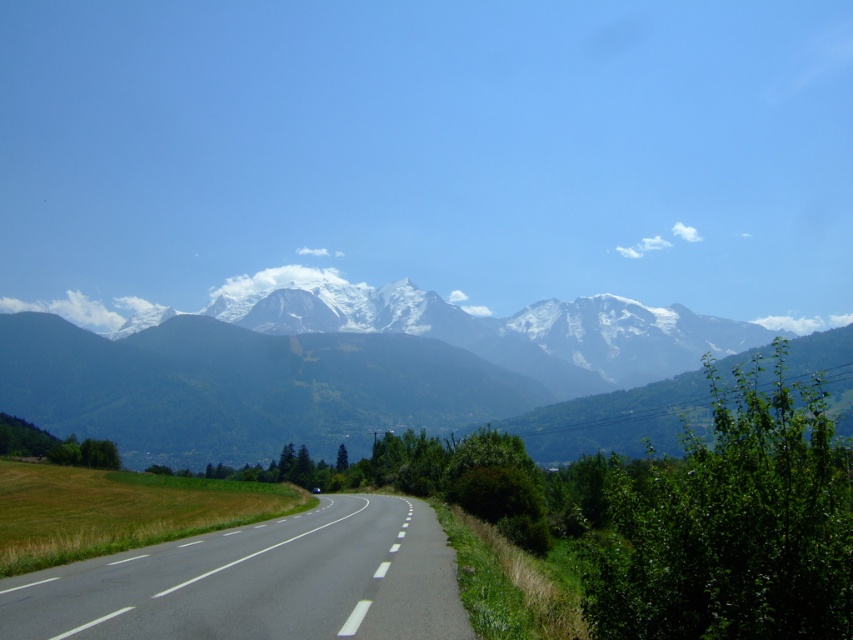
Is snowy granite mountains at upper center shorter than black asphalt road at center?

No, snowy granite mountains at upper center is not shorter than black asphalt road at center.

Is snowy granite mountains at upper center smaller than black asphalt road at center?

Incorrect, snowy granite mountains at upper center is not smaller in size than black asphalt road at center.

Is point (444, 374) positioned after point (421, 540)?

Yes, it is behind point (421, 540).

Find the location of a particular element. The height and width of the screenshot is (640, 853). snowy granite mountains at upper center is located at coordinates (334, 365).